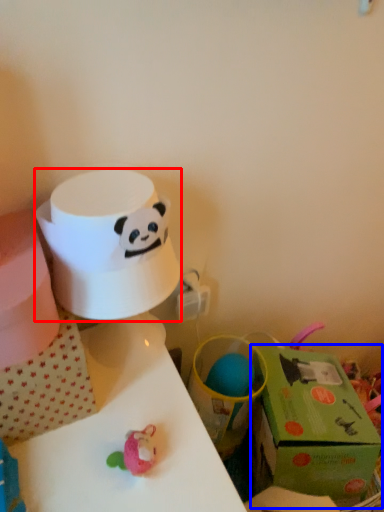
Question: Which point is closer to the camera, paper towel (highlighted by a red box) or gift box (highlighted by a blue box)?

Choices:
 (A) paper towel
 (B) gift box

Answer: (A)